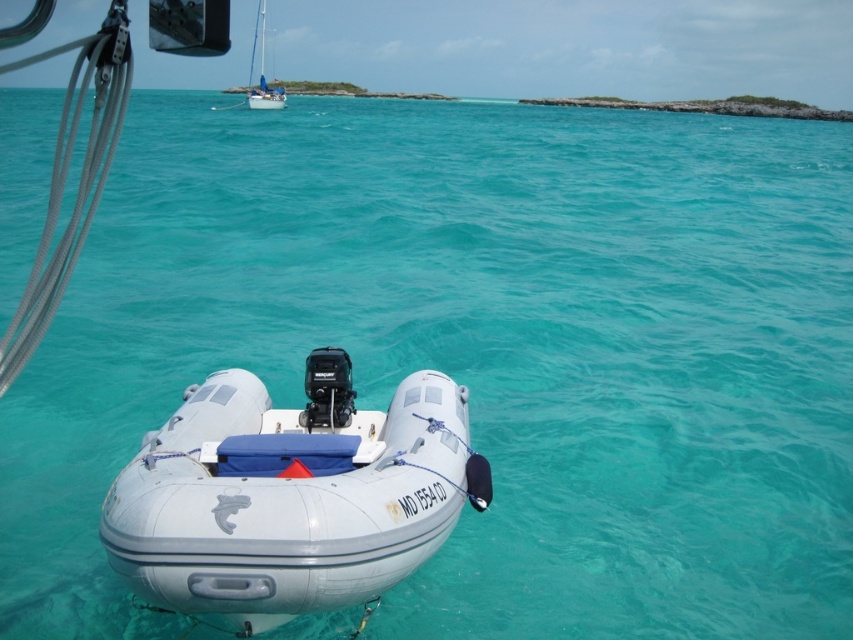
You are standing on the deck of a boat and want to know how far you are from the point marked at coordinates (407, 472). Can you determine the distance?

The point marked at coordinates (407, 472) is 14.66 feet away from the camera, so you are 14.66 feet away from that point.

Consider the image. You are a sailor trying to navigate between the white rubber dinghy at center and the white glossy sailboat at upper center. Which direction should you steer to move from the sailboat to the dinghy?

You should steer to the right to move from the white glossy sailboat at upper center to the white rubber dinghy at center since the dinghy is positioned on the right side of the sailboat.

You are a sailor who needs to board the white glossy sailboat at upper center from the white rubber dinghy at center. Considering their sizes, which vessel will you have to step down onto from the other?

The white rubber dinghy at center has a smaller size compared to the white glossy sailboat at upper center. Therefore, you would step down onto the white rubber dinghy at center from the larger sailboat.